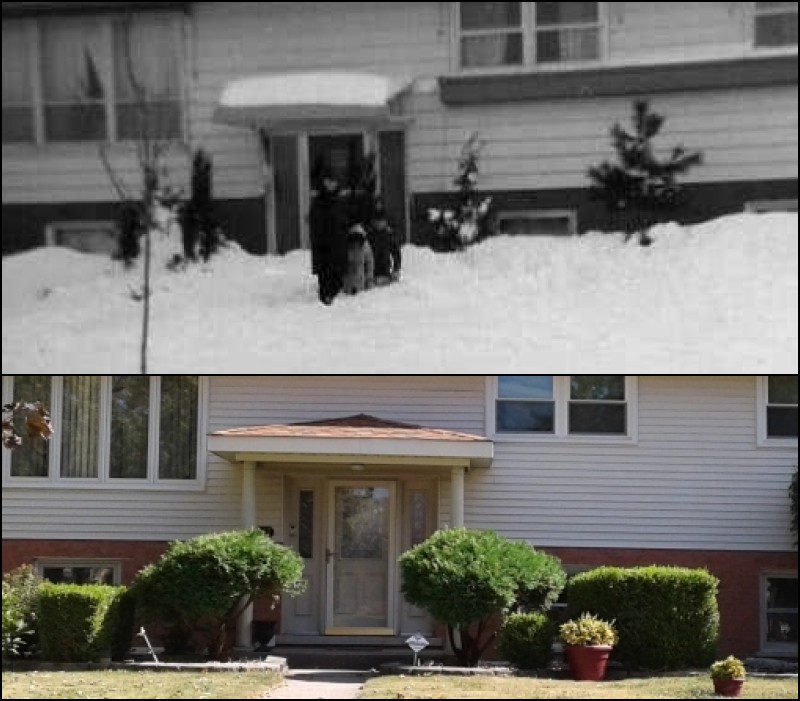
At what (x,y) coordinates should I click in order to perform the action: click on potted plant. Please return your answer as a coordinate pair (x, y). Looking at the image, I should click on (597, 655), (726, 690).